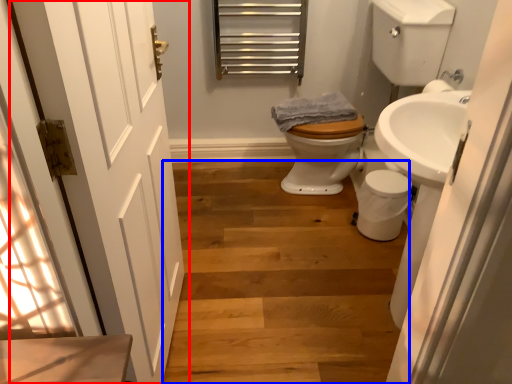
Question: Which object is closer to the camera taking this photo, door (highlighted by a red box) or stairs (highlighted by a blue box)?

Choices:
 (A) door
 (B) stairs

Answer: (A)